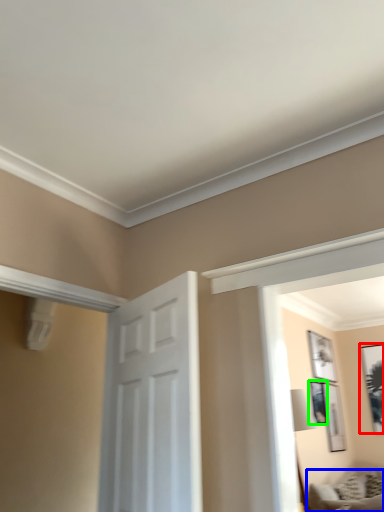
Question: Which object is the closest to the picture frame (highlighted by a red box)? Choose among these: furniture (highlighted by a blue box) or picture frame (highlighted by a green box).

Choices:
 (A) furniture
 (B) picture frame

Answer: (B)